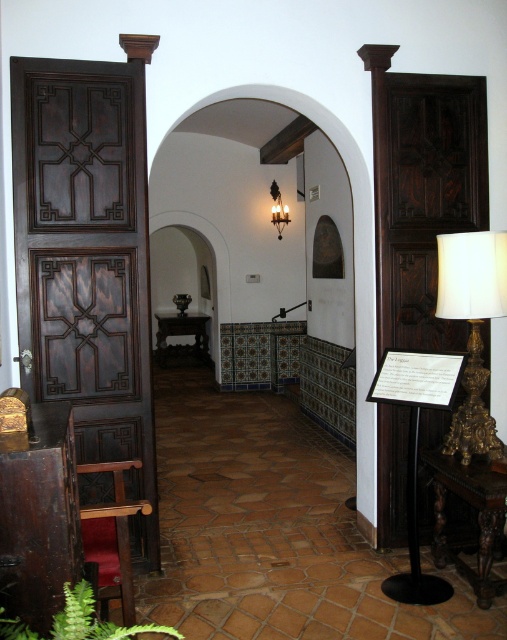
Question: Which is nearer to the wooden polished chair at lower left?

Choices:
 (A) dark wood paneling at left
 (B) green leafy fern at lower left
 (C) dark wood carved door at right

Answer: (B)

Question: Can you confirm if dark wood paneling at left is positioned to the left of wooden polished chair at lower left?

Choices:
 (A) no
 (B) yes

Answer: (B)

Question: Among these objects, which one is farthest from the camera?

Choices:
 (A) wooden polished chair at lower left
 (B) dark wood paneling at left

Answer: (B)

Question: Among these points, which one is farthest from the camera?

Choices:
 (A) (451, 316)
 (B) (139, 122)

Answer: (B)

Question: Does green leafy fern at lower left appear over matte black sconce at upper center?

Choices:
 (A) yes
 (B) no

Answer: (B)

Question: Is gold ornate lamp at right further to camera compared to matte black sconce at upper center?

Choices:
 (A) yes
 (B) no

Answer: (B)